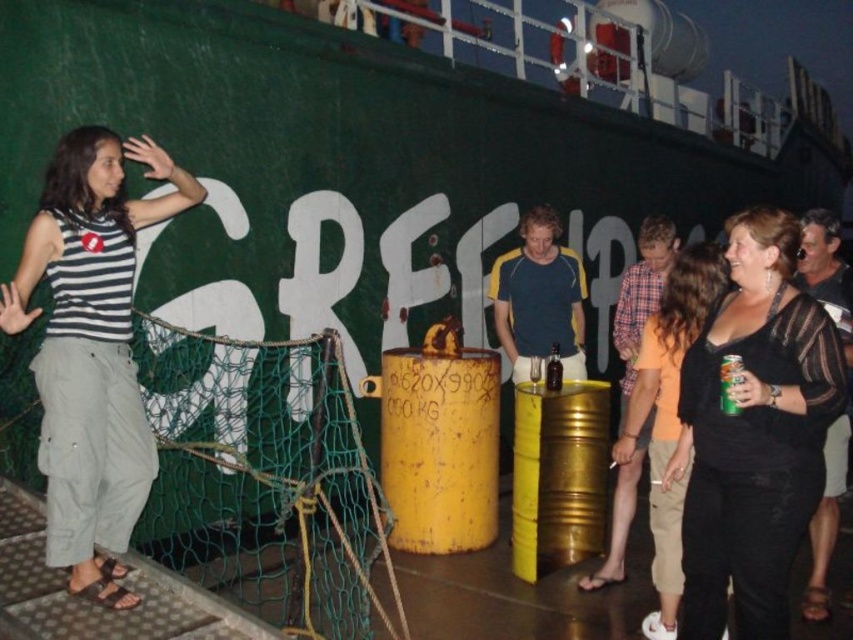
Is point (492, 483) behind point (543, 481)?

Yes, point (492, 483) is behind point (543, 481).

Who is more forward, (469, 356) or (566, 435)?

Point (566, 435) is in front.

The image size is (853, 640). Identify the location of yellow matte barrel at center. (439, 445).

How distant is black sheer top at center from striped fabric shirt at left?

They are 8.49 feet apart.

Measure the distance between black sheer top at center and camera.

They are 3.20 meters apart.

This screenshot has height=640, width=853. In order to click on black sheer top at center in this screenshot , I will do `click(753, 433)`.

Is black sheer top at center smaller than green matte can at center?

No.

Between black sheer top at center and green matte can at center, which one appears on the left side from the viewer's perspective?

From the viewer's perspective, green matte can at center appears more on the left side.

Locate an element on the screen. black sheer top at center is located at coordinates (753, 433).